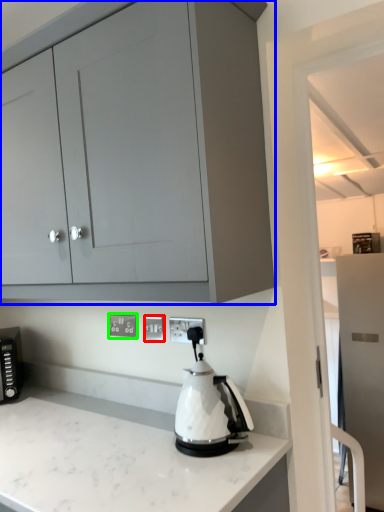
Question: Estimate the real-world distances between objects in this image. Which object is closer to electric outlet (highlighted by a red box), cabinetry (highlighted by a blue box) or electric outlet (highlighted by a green box)?

Choices:
 (A) cabinetry
 (B) electric outlet

Answer: (B)